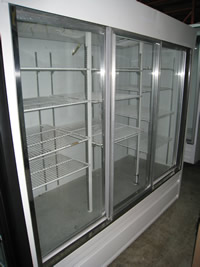
I want to click on metallic doorframes of fridge, so click(x=85, y=230), click(x=112, y=202), click(x=162, y=176).